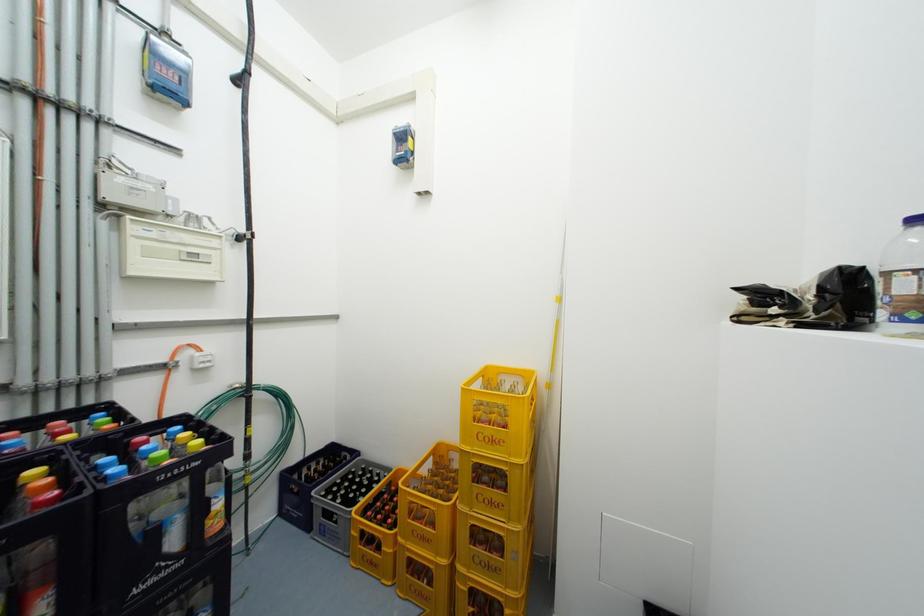
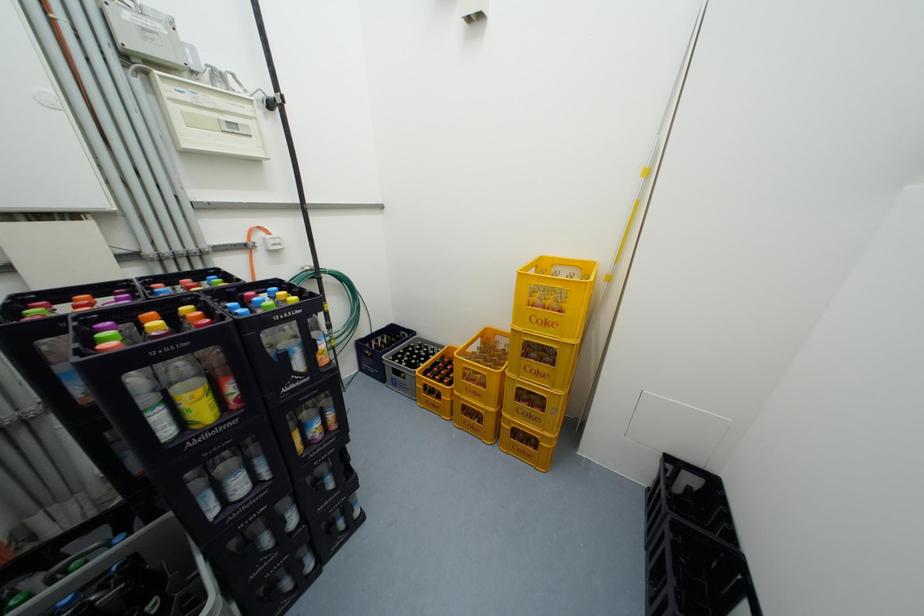
Question: What movement of the cameraman would produce the second image?

Choices:
 (A) Left
 (B) Right
 (C) Forward
 (D) Backward

Answer: (A)